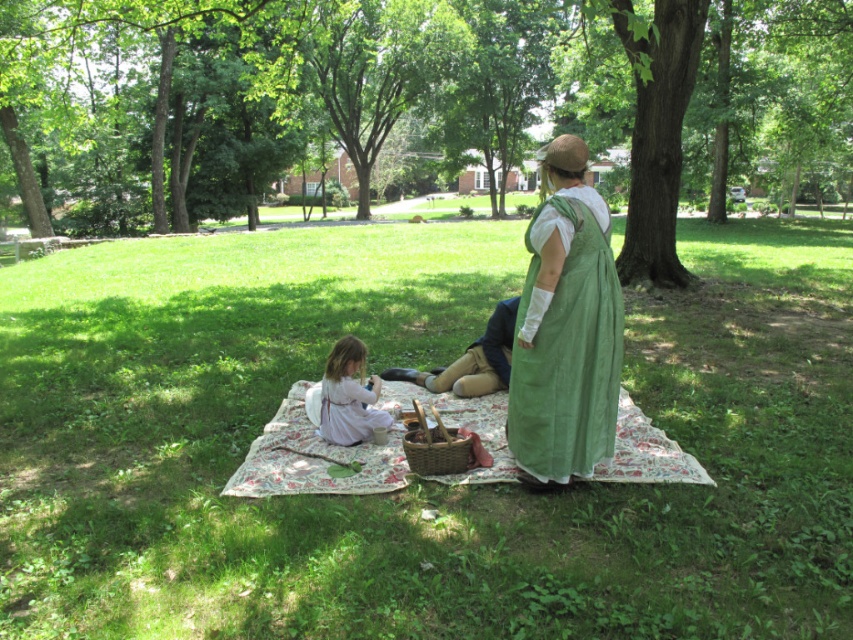
Question: Is green grass at center positioned behind pale pink fabric at lower left?

Choices:
 (A) no
 (B) yes

Answer: (A)

Question: Which of the following is the farthest from the observer?

Choices:
 (A) green grass at center
 (B) pale pink fabric at lower left
 (C) white cotton cloth at center

Answer: (B)

Question: Which is nearer to the green grass at center?

Choices:
 (A) pale pink fabric at lower left
 (B) brown woven picnic basket at center

Answer: (B)

Question: Considering the real-world distances, which object is closest to the white cotton cloth at center?

Choices:
 (A) brown woven picnic basket at center
 (B) green grass at center
 (C) green fabric dress at center
 (D) pale pink fabric at lower left

Answer: (A)

Question: Is the position of pale pink fabric at lower left more distant than that of brown woven picnic basket at center?

Choices:
 (A) no
 (B) yes

Answer: (B)

Question: Can you confirm if white cotton cloth at center is positioned below pale pink fabric at lower left?

Choices:
 (A) yes
 (B) no

Answer: (A)